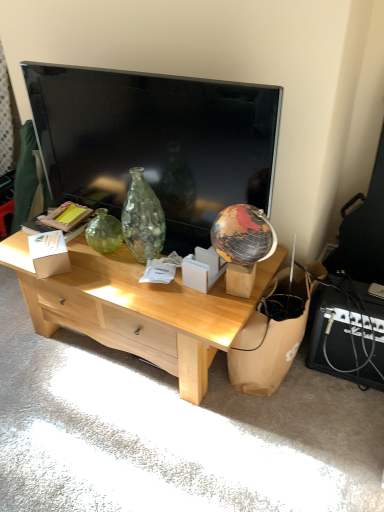
I want to click on light wood desk at center, so click(137, 308).

Where is `white cardboard box at center, marked as the 2th cardboard box in a right-to-left arrangement`? This screenshot has height=512, width=384. white cardboard box at center, marked as the 2th cardboard box in a right-to-left arrangement is located at coordinates (49, 254).

The image size is (384, 512). Find the location of `flat screen tv at upper center`. flat screen tv at upper center is located at coordinates (156, 142).

In terms of height, does flat screen tv at upper center look taller or shorter compared to white cardboard box at center, which is the 2th cardboard box in left-to-right order?

Clearly, flat screen tv at upper center is taller compared to white cardboard box at center, which is the 2th cardboard box in left-to-right order.

Which object is positioned more to the right, flat screen tv at upper center or white cardboard box at center, the first cardboard box in the right-to-left sequence?

Positioned to the right is white cardboard box at center, the first cardboard box in the right-to-left sequence.

Relative to white cardboard box at center, which is the 2th cardboard box in left-to-right order, is flat screen tv at upper center in front or behind?

flat screen tv at upper center is positioned closer to the viewer than white cardboard box at center, which is the 2th cardboard box in left-to-right order.

Could you tell me if white cardboard box at center, the first cardboard box in the right-to-left sequence, is facing light wood desk at center?

No.

From the picture: Is white cardboard box at center, which is the 2th cardboard box in left-to-right order, bigger than light wood desk at center?

No, white cardboard box at center, which is the 2th cardboard box in left-to-right order, is not bigger than light wood desk at center.

Is white cardboard box at center, which is the 2th cardboard box in left-to-right order, outside of light wood desk at center?

That's correct, white cardboard box at center, which is the 2th cardboard box in left-to-right order, is outside of light wood desk at center.

Between white cardboard box at center, which is the 2th cardboard box in left-to-right order, and light wood desk at center, which one appears on the right side from the viewer's perspective?

From the viewer's perspective, white cardboard box at center, which is the 2th cardboard box in left-to-right order, appears more on the right side.

Considering the relative positions of light wood desk at center and flat screen tv at upper center in the image provided, is light wood desk at center to the right of flat screen tv at upper center from the viewer's perspective?

In fact, light wood desk at center is to the left of flat screen tv at upper center.

Consider the image. Is light wood desk at center wider than flat screen tv at upper center?

Indeed, light wood desk at center has a greater width compared to flat screen tv at upper center.

Locate an element on the screen. desk behind the flat screen tv at upper center is located at coordinates click(x=137, y=308).

Who is taller, light wood desk at center or flat screen tv at upper center?

flat screen tv at upper center is taller.

Choose the correct answer: Is white cardboard box at center, which is the first cardboard box from left to right, inside white cardboard box at center, the first cardboard box in the right-to-left sequence, or outside it?

white cardboard box at center, which is the first cardboard box from left to right, cannot be found inside white cardboard box at center, the first cardboard box in the right-to-left sequence.

Does white cardboard box at center, marked as the 2th cardboard box in a right-to-left arrangement, have a lesser width compared to white cardboard box at center, which is the 2th cardboard box in left-to-right order?

In fact, white cardboard box at center, marked as the 2th cardboard box in a right-to-left arrangement, might be wider than white cardboard box at center, which is the 2th cardboard box in left-to-right order.

From the image's perspective, is white cardboard box at center, marked as the 2th cardboard box in a right-to-left arrangement, located above white cardboard box at center, the first cardboard box in the right-to-left sequence?

Indeed, from the image's perspective, white cardboard box at center, marked as the 2th cardboard box in a right-to-left arrangement, is shown above white cardboard box at center, the first cardboard box in the right-to-left sequence.

Is brown paper bag at lower right placed right next to light wood desk at center?

brown paper bag at lower right and light wood desk at center are not in contact.

From a real-world perspective, is brown paper bag at lower right physically located above or below light wood desk at center?

Clearly, from a real-world perspective, brown paper bag at lower right is below light wood desk at center.

Based on the photo, from the image's perspective, is brown paper bag at lower right located above or below light wood desk at center?

Based on their image positions, brown paper bag at lower right is located beneath light wood desk at center.

Does brown paper bag at lower right have a larger size compared to light wood desk at center?

Actually, brown paper bag at lower right might be smaller than light wood desk at center.

Relative to flat screen tv at upper center, is white cardboard box at center, marked as the 2th cardboard box in a right-to-left arrangement, in front or behind?

white cardboard box at center, marked as the 2th cardboard box in a right-to-left arrangement, is behind flat screen tv at upper center.

Is white cardboard box at center, marked as the 2th cardboard box in a right-to-left arrangement, wider than flat screen tv at upper center?

Indeed, white cardboard box at center, marked as the 2th cardboard box in a right-to-left arrangement, has a greater width compared to flat screen tv at upper center.

From the image's perspective, who appears lower, white cardboard box at center, marked as the 2th cardboard box in a right-to-left arrangement, or flat screen tv at upper center?

white cardboard box at center, marked as the 2th cardboard box in a right-to-left arrangement, is shown below in the image.

Is white cardboard box at center, which is the first cardboard box from left to right, positioned with its back to flat screen tv at upper center?

Absolutely, white cardboard box at center, which is the first cardboard box from left to right, is directed away from flat screen tv at upper center.

Find the location of `cardboard lying in front of the white cardboard box at center, the first cardboard box in the right-to-left sequence`. cardboard lying in front of the white cardboard box at center, the first cardboard box in the right-to-left sequence is located at coordinates (272, 338).

Considering the sizes of objects white cardboard box at center, the first cardboard box in the right-to-left sequence, and brown paper bag at lower right in the image provided, who is wider, white cardboard box at center, the first cardboard box in the right-to-left sequence, or brown paper bag at lower right?

brown paper bag at lower right.

Who is shorter, white cardboard box at center, the first cardboard box in the right-to-left sequence, or brown paper bag at lower right?

white cardboard box at center, the first cardboard box in the right-to-left sequence.

Can you tell me how much white cardboard box at center, the first cardboard box in the right-to-left sequence, and brown paper bag at lower right differ in facing direction?

91.9 degrees.

The width and height of the screenshot is (384, 512). Find the location of `the 1st cardboard box behind the flat screen tv at upper center, starting your count from the anchor`. the 1st cardboard box behind the flat screen tv at upper center, starting your count from the anchor is located at coordinates (202, 269).

This screenshot has width=384, height=512. I want to click on the 2nd cardboard box positioned above the light wood desk at center (from a real-world perspective), so click(x=202, y=269).

Estimate the real-world distances between objects in this image. Which object is closer to light wood desk at center, white cardboard box at center, the first cardboard box in the right-to-left sequence, or brown paper bag at lower right?

white cardboard box at center, the first cardboard box in the right-to-left sequence, is closer to light wood desk at center.

When comparing their distances from brown paper bag at lower right, does light wood desk at center or flat screen tv at upper center seem further?

flat screen tv at upper center is positioned further to the anchor brown paper bag at lower right.

From the image, which object appears to be nearer to white cardboard box at center, marked as the 2th cardboard box in a right-to-left arrangement, white cardboard box at center, which is the 2th cardboard box in left-to-right order, or flat screen tv at upper center?

Among the two, flat screen tv at upper center is located nearer to white cardboard box at center, marked as the 2th cardboard box in a right-to-left arrangement.

Looking at the image, which one is located closer to white cardboard box at center, the first cardboard box in the right-to-left sequence, flat screen tv at upper center or brown paper bag at lower right?

Based on the image, brown paper bag at lower right appears to be nearer to white cardboard box at center, the first cardboard box in the right-to-left sequence.

Based on their spatial positions, is flat screen tv at upper center or white cardboard box at center, which is the 2th cardboard box in left-to-right order, further from white cardboard box at center, marked as the 2th cardboard box in a right-to-left arrangement?

The object further to white cardboard box at center, marked as the 2th cardboard box in a right-to-left arrangement, is white cardboard box at center, which is the 2th cardboard box in left-to-right order.

From the image, which object appears to be farther from white cardboard box at center, which is the 2th cardboard box in left-to-right order, brown paper bag at lower right or flat screen tv at upper center?

Among the two, flat screen tv at upper center is located further to white cardboard box at center, which is the 2th cardboard box in left-to-right order.

When comparing their distances from light wood desk at center, does white cardboard box at center, which is the 2th cardboard box in left-to-right order, or white cardboard box at center, marked as the 2th cardboard box in a right-to-left arrangement, seem closer?

white cardboard box at center, which is the 2th cardboard box in left-to-right order, is positioned closer to the anchor light wood desk at center.

When comparing their distances from flat screen tv at upper center, does light wood desk at center or brown paper bag at lower right seem further?

brown paper bag at lower right lies further to flat screen tv at upper center than the other object.

The image size is (384, 512). What are the coordinates of `television situated between white cardboard box at center, marked as the 2th cardboard box in a right-to-left arrangement, and white cardboard box at center, which is the 2th cardboard box in left-to-right order, from left to right` in the screenshot? It's located at (156, 142).

The height and width of the screenshot is (512, 384). Find the location of `desk between white cardboard box at center, marked as the 2th cardboard box in a right-to-left arrangement, and brown paper bag at lower right`. desk between white cardboard box at center, marked as the 2th cardboard box in a right-to-left arrangement, and brown paper bag at lower right is located at coordinates (137, 308).

Identify the location of television located between white cardboard box at center, marked as the 2th cardboard box in a right-to-left arrangement, and brown paper bag at lower right in the left-right direction. (156, 142).

This screenshot has width=384, height=512. I want to click on desk located between white cardboard box at center, which is the first cardboard box from left to right, and white cardboard box at center, which is the 2th cardboard box in left-to-right order, in the left-right direction, so coord(137,308).